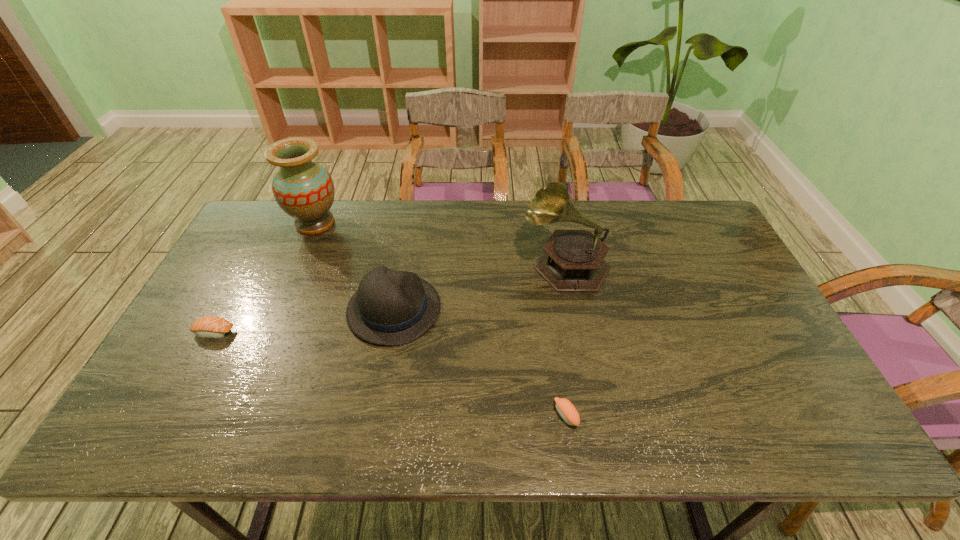
At what (x,y) coordinates should I click in order to perform the action: click on object present at the far left corner. Please return your answer as a coordinate pair (x, y). The image size is (960, 540). Looking at the image, I should click on tap(303, 189).

The image size is (960, 540). Identify the location of vacant region at the far edge of the desktop. (624, 205).

This screenshot has height=540, width=960. What are the coordinates of `vacant space at the near edge of the desktop` in the screenshot? It's located at (689, 420).

In the image, there is a desktop. Identify the location of vacant region at the left edge. The height and width of the screenshot is (540, 960). (179, 386).

Where is `free space at the right edge`? The height and width of the screenshot is (540, 960). free space at the right edge is located at coordinates (713, 303).

In the image, there is a desktop. At what (x,y) coordinates should I click in order to perform the action: click on vacant region at the far right corner. Please return your answer as a coordinate pair (x, y). Looking at the image, I should click on (679, 222).

Find the location of a particular element. free space between the second object from left to right and the nearer sushi is located at coordinates (441, 319).

Identify the location of empty space between the farther sushi and the right sushi. (390, 374).

Find the location of a particular element. Image resolution: width=960 pixels, height=540 pixels. vacant area that lies between the right sushi and the leftmost object is located at coordinates (390, 374).

This screenshot has height=540, width=960. I want to click on vacant area between the left sushi and the fourth object from right to left, so click(x=264, y=278).